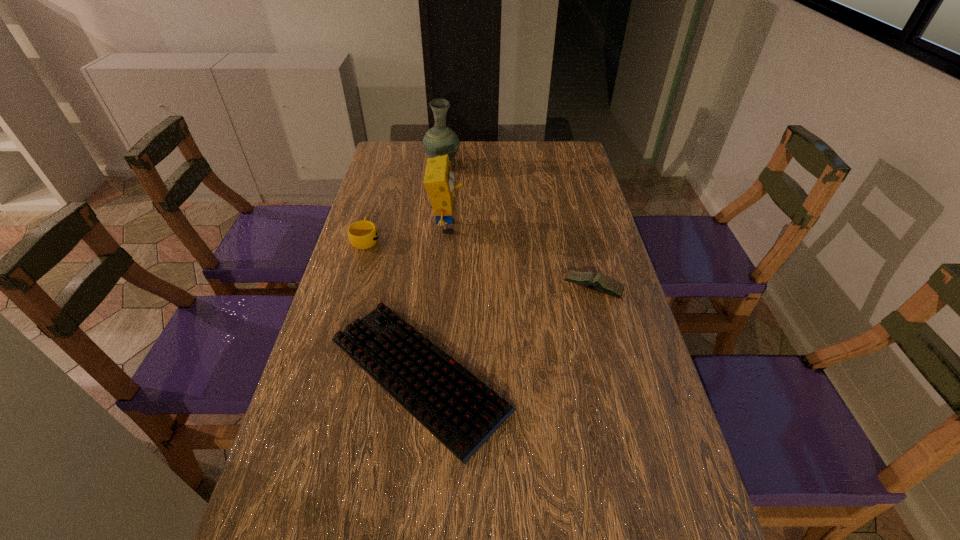
The image size is (960, 540). I want to click on vacant space at the far right corner of the desktop, so click(x=562, y=152).

At what (x,y) coordinates should I click in order to perform the action: click on empty space between the diary and the pitcher. Please return your answer as a coordinate pair (x, y). Looking at the image, I should click on (517, 227).

You are a GUI agent. You are given a task and a screenshot of the screen. Output one action in this format:
    pyautogui.click(x=<x>, y=<y>)
    Task: Click on the vacant region between the diary and the nearest object
    This screenshot has height=540, width=960.
    Given the screenshot: What is the action you would take?
    pyautogui.click(x=505, y=331)

Identify the location of blank region between the rightmost object and the sponge. (520, 258).

Identify the location of free point between the cup and the farthest object. The width and height of the screenshot is (960, 540). (404, 202).

Find the location of `free spot between the cup and the pitcher`. free spot between the cup and the pitcher is located at coordinates (404, 202).

This screenshot has width=960, height=540. What are the coordinates of `free point between the cup and the sponge` in the screenshot? It's located at (406, 233).

Where is `the third closest object relative to the sponge`? The width and height of the screenshot is (960, 540). the third closest object relative to the sponge is located at coordinates (460, 410).

Identify which object is the second nearest to the farthest object. Please provide its 2D coordinates. Your answer should be formatted as a tuple, i.e. [(x, y)], where the tuple contains the x and y coordinates of a point satisfying the conditions above.

[(363, 234)]

I want to click on free point that satisfies the following two spatial constraints: 1. on the face of the sponge; 2. on the front side of the nearest object, so click(x=435, y=374).